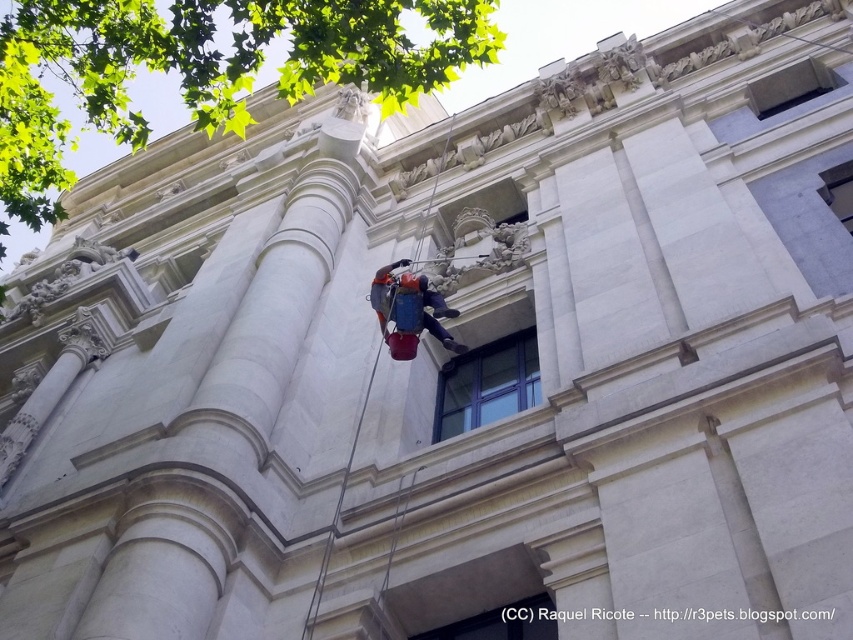
Question: Which of the following is the closest to the observer?

Choices:
 (A) blue glass window at center
 (B) orange fabric harness at center

Answer: (B)

Question: Where is blue glass window at center located in relation to orange fabric harness at center in the image?

Choices:
 (A) left
 (B) right

Answer: (B)

Question: Can you confirm if blue glass window at center is bigger than orange fabric harness at center?

Choices:
 (A) yes
 (B) no

Answer: (B)

Question: Among these objects, which one is farthest from the camera?

Choices:
 (A) orange fabric harness at center
 (B) blue glass window at center

Answer: (B)

Question: Among these points, which one is nearest to the camera?

Choices:
 (A) (491, 394)
 (B) (399, 330)

Answer: (B)

Question: Can you confirm if blue glass window at center is wider than orange fabric harness at center?

Choices:
 (A) yes
 (B) no

Answer: (A)